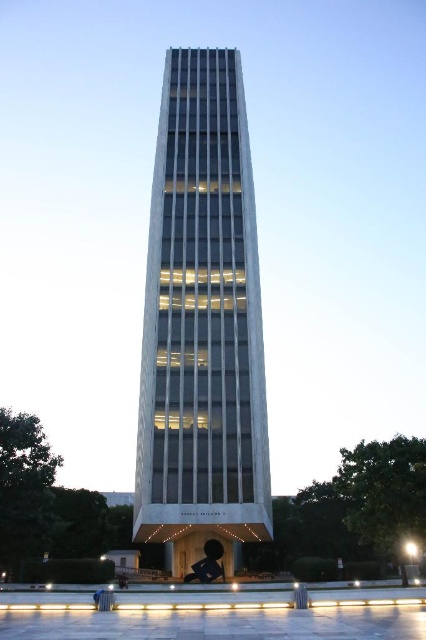
Question: Is white glass tower at center to the left of black glossy statue at center from the viewer's perspective?

Choices:
 (A) no
 (B) yes

Answer: (B)

Question: Can you confirm if white glass tower at center is positioned above black glossy statue at center?

Choices:
 (A) yes
 (B) no

Answer: (A)

Question: Among these points, which one is nearest to the camera?

Choices:
 (A) (216, 545)
 (B) (144, 404)

Answer: (A)

Question: Among these objects, which one is farthest from the camera?

Choices:
 (A) black glossy statue at center
 (B) white glass tower at center

Answer: (A)

Question: Which point is closer to the camera?

Choices:
 (A) black glossy statue at center
 (B) white glass tower at center

Answer: (B)

Question: Is the position of white glass tower at center more distant than that of black glossy statue at center?

Choices:
 (A) no
 (B) yes

Answer: (A)